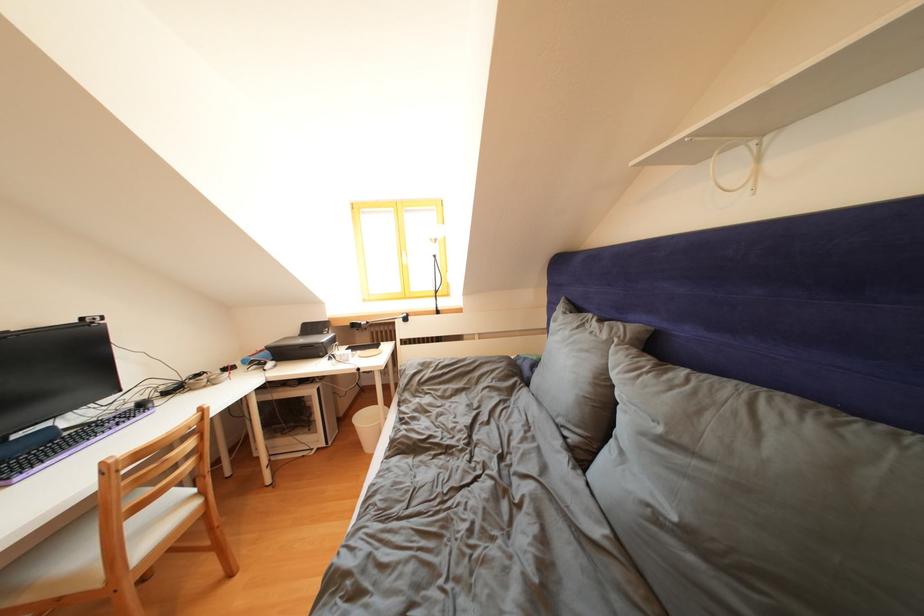
The image size is (924, 616). Identify the location of desk lamp arm. (435, 260).